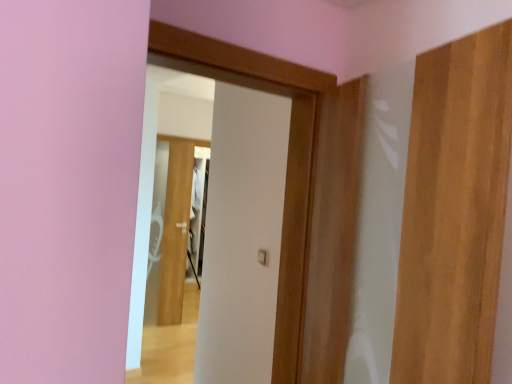
Question: Considering the relative sizes of wooden door at right, the first door viewed from the right, and white glossy door at center, the first door positioned from the left, in the image provided, is wooden door at right, the first door viewed from the right, bigger than white glossy door at center, the first door positioned from the left,?

Choices:
 (A) no
 (B) yes

Answer: (B)

Question: From a real-world perspective, is wooden door at right, which is counted as the first door, starting from the front, located beneath white glossy door at center, the first door positioned from the back?

Choices:
 (A) yes
 (B) no

Answer: (B)

Question: Is wooden door at right, acting as the 3th door starting from the back, positioned beyond the bounds of white glossy door at center, the third door viewed from the front?

Choices:
 (A) yes
 (B) no

Answer: (A)

Question: From the image's perspective, is wooden door at right, the first door viewed from the right, above white glossy door at center, the first door positioned from the back?

Choices:
 (A) no
 (B) yes

Answer: (B)

Question: Considering the relative sizes of wooden door at right, which is counted as the first door, starting from the front, and white glossy door at center, the third door viewed from the front, in the image provided, is wooden door at right, which is counted as the first door, starting from the front, shorter than white glossy door at center, the third door viewed from the front,?

Choices:
 (A) yes
 (B) no

Answer: (A)

Question: Considering their positions, is white matte door at center, the 2th door when ordered from back to front, located in front of or behind wooden door at right, the first door viewed from the right?

Choices:
 (A) front
 (B) behind

Answer: (B)

Question: Based on their positions, is white matte door at center, the second door in the right-to-left sequence, located to the left or right of wooden door at right, which is counted as the first door, starting from the front?

Choices:
 (A) left
 (B) right

Answer: (A)

Question: In terms of width, does white matte door at center, arranged as the second door when viewed from the front, look wider or thinner when compared to wooden door at right, which is counted as the first door, starting from the front?

Choices:
 (A) wide
 (B) thin

Answer: (A)

Question: From the image's perspective, is white matte door at center, which ranks as the second door in left-to-right order, positioned above or below wooden door at right, acting as the 3th door starting from the back?

Choices:
 (A) below
 (B) above

Answer: (B)

Question: Considering their positions, is white glossy door at center, the 3th door viewed from the right, located in front of or behind wooden door at right, acting as the 3th door starting from the back?

Choices:
 (A) behind
 (B) front

Answer: (A)

Question: From a real-world perspective, is white glossy door at center, the first door positioned from the left, positioned above or below wooden door at right, positioned as the 3th door in left-to-right order?

Choices:
 (A) below
 (B) above

Answer: (A)

Question: Based on their positions, is white glossy door at center, the 3th door viewed from the right, located to the left or right of wooden door at right, acting as the 3th door starting from the back?

Choices:
 (A) right
 (B) left

Answer: (B)

Question: Is white glossy door at center, the third door viewed from the front, wider or thinner than wooden door at right, positioned as the 3th door in left-to-right order?

Choices:
 (A) wide
 (B) thin

Answer: (B)

Question: Is point (472, 228) closer or farther from the camera than point (304, 147)?

Choices:
 (A) closer
 (B) farther

Answer: (A)

Question: From a real-world perspective, is wooden door at right, the first door viewed from the right, positioned above or below white matte door at center, the 2th door when ordered from back to front?

Choices:
 (A) below
 (B) above

Answer: (B)